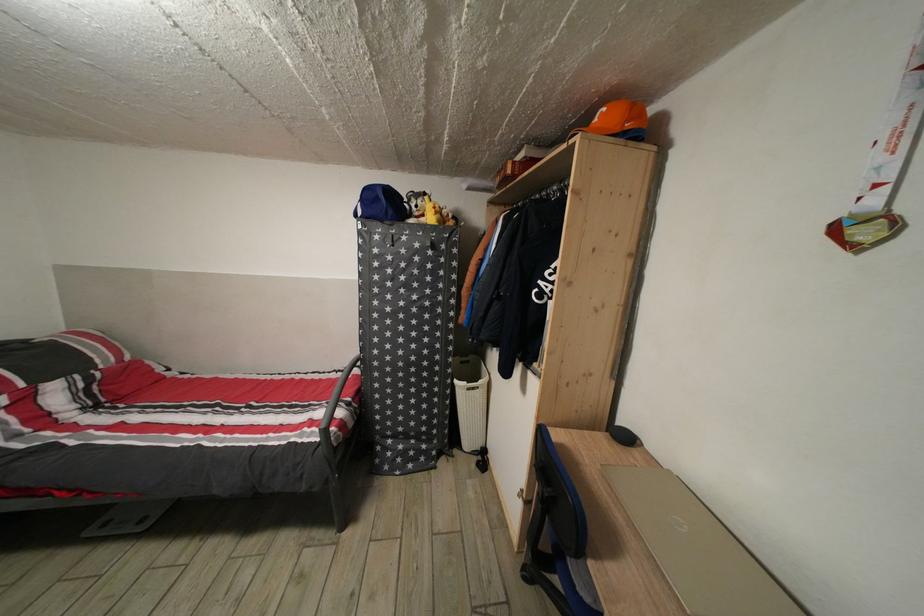
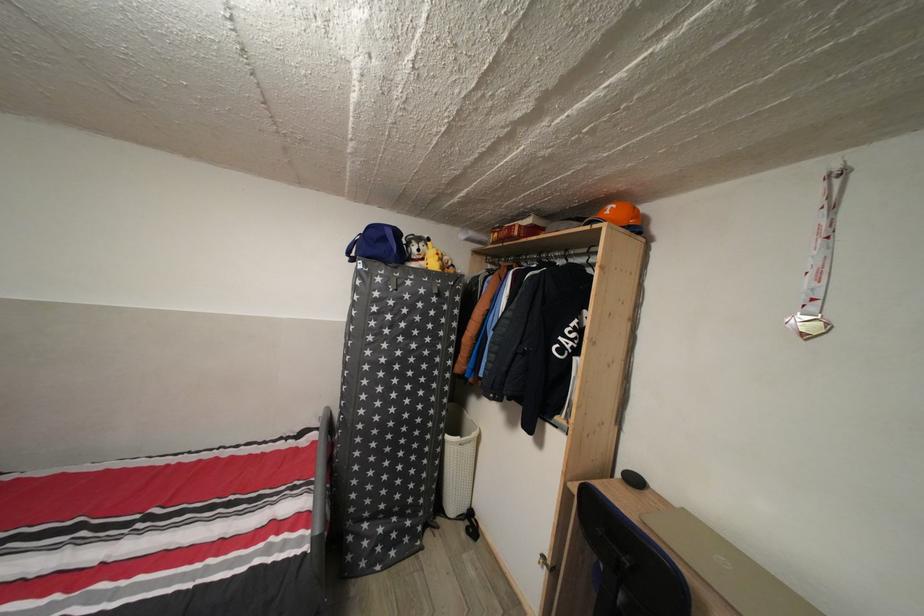
Question: How did the camera likely rotate?

Choices:
 (A) Left
 (B) Right
 (C) Up
 (D) Down

Answer: (B)